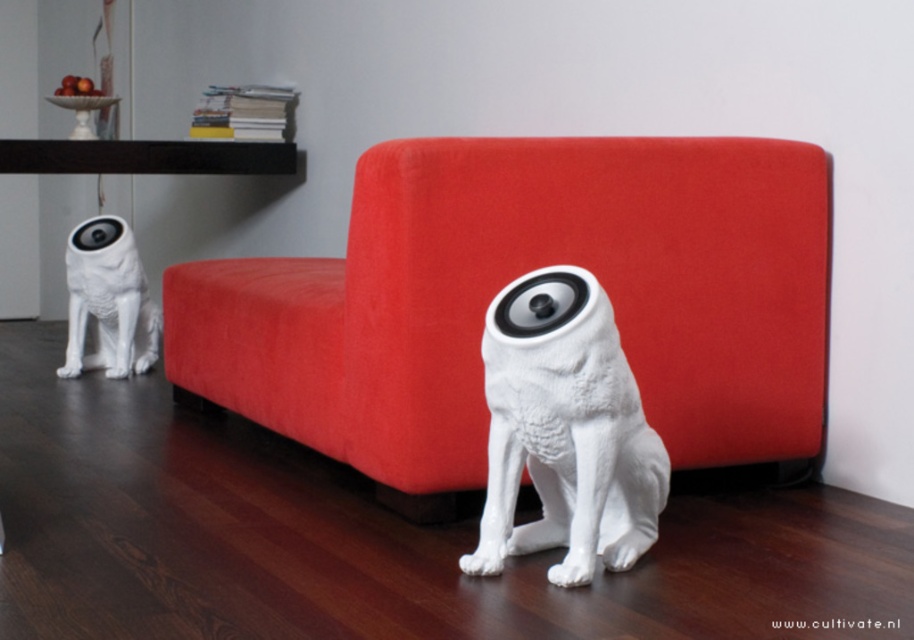
Does point (689, 388) come farther from viewer compared to point (645, 467)?

Yes, point (689, 388) is farther from viewer.

Measure the distance between red velvet couch at center and camera.

red velvet couch at center and camera are 6.21 feet apart.

Describe the element at coordinates (512, 278) in the screenshot. I see `red velvet couch at center` at that location.

Where is `red velvet couch at center`? The height and width of the screenshot is (640, 914). red velvet couch at center is located at coordinates (512, 278).

Is white matte speaker dog at left to the right of white matte dog at lower left from the viewer's perspective?

Answer: Indeed, white matte speaker dog at left is positioned on the right side of white matte dog at lower left.

Who is higher up, white matte speaker dog at left or white matte dog at lower left?

white matte dog at lower left is higher up.

Identify the location of white matte speaker dog at left. (565, 432).

Who is taller, red velvet couch at center or white matte dog at lower left?

red velvet couch at center

Can you confirm if red velvet couch at center is positioned above white matte dog at lower left?

No, red velvet couch at center is not above white matte dog at lower left.

Who is more forward, (339, 282) or (134, 260)?

Positioned in front is point (339, 282).

The height and width of the screenshot is (640, 914). I want to click on red velvet couch at center, so click(512, 278).